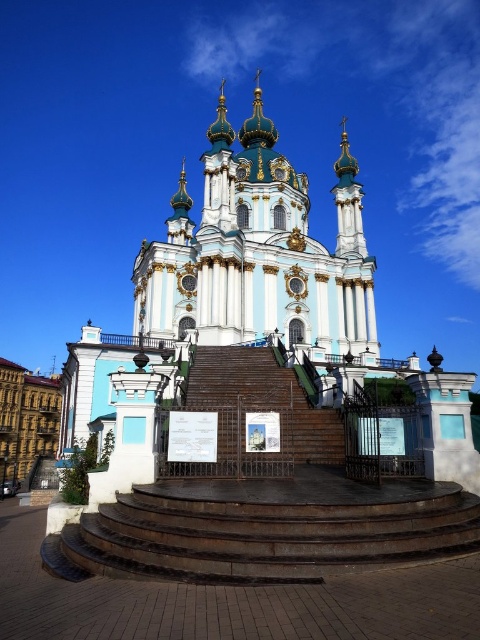
You are standing at the base of the church steps and want to know how far the point at coordinate (455,419) is from you. Can you determine the distance?

The point at coordinate (455,419) is 44.11 meters away from you.

You are a tourist visiting the church and want to take a photo of both the white marble church at center and the brown wooden stairs at center. Which object should you focus on first if you want to include both in your frame without zooming in or out?

The white marble church at center is bigger than the brown wooden stairs at center, so you should focus on the white marble church at center first to ensure it fits in the frame while still capturing the brown wooden stairs at center.